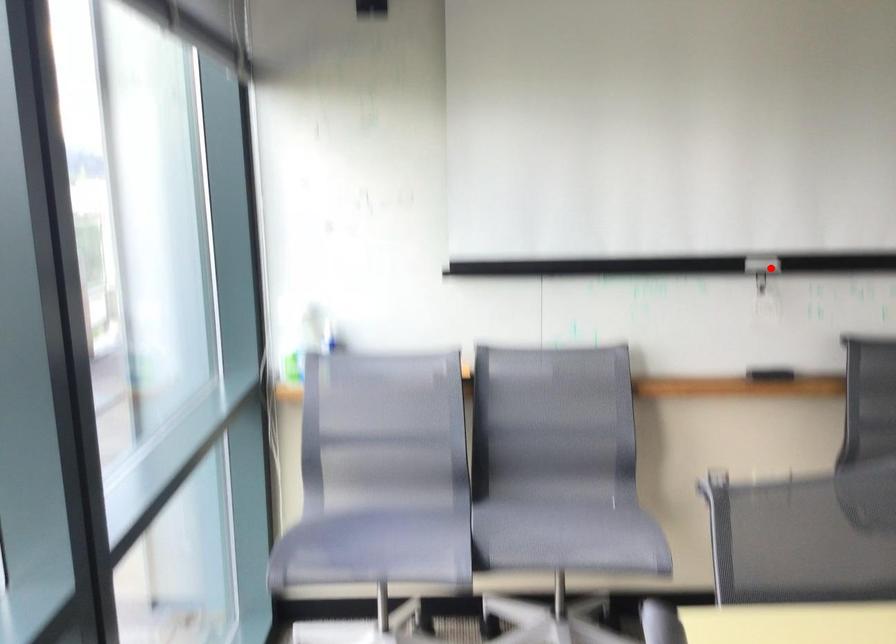
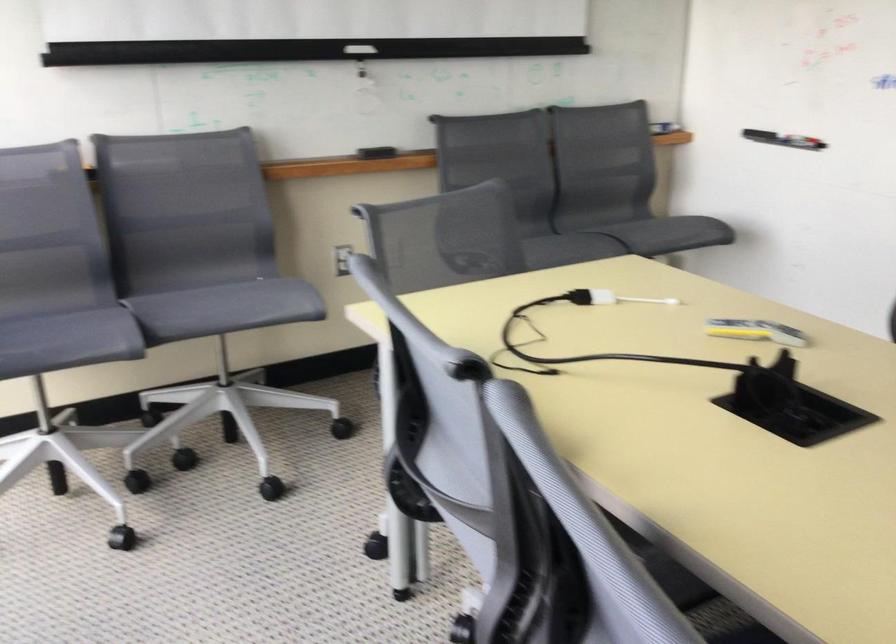
Question: A red point is marked in image1. In image2, is the corresponding 3D point closer to the camera or farther? Reply with the corresponding letter.

Choices:
 (A) The corresponding 3D point is closer.
 (B) The corresponding 3D point is farther.

Answer: (B)